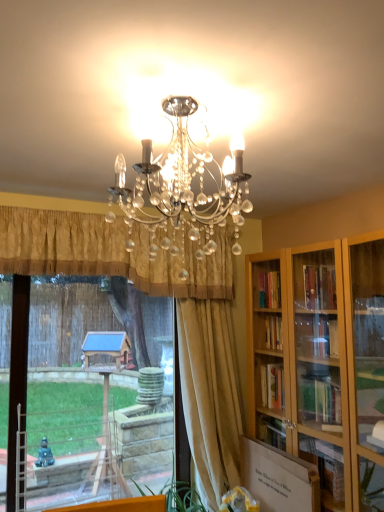
Question: Does gold pleated curtain at center, placed as the first curtain when sorted from left to right, have a smaller size compared to silky beige curtain at center, positioned as the first curtain in right-to-left order?

Choices:
 (A) no
 (B) yes

Answer: (A)

Question: Is gold pleated curtain at center, acting as the 2th curtain starting from the right, beside silky beige curtain at center, positioned as the first curtain in right-to-left order?

Choices:
 (A) yes
 (B) no

Answer: (B)

Question: Considering the relative sizes of gold pleated curtain at center, placed as the first curtain when sorted from left to right, and silky beige curtain at center, positioned as the first curtain in right-to-left order, in the image provided, is gold pleated curtain at center, placed as the first curtain when sorted from left to right, taller than silky beige curtain at center, positioned as the first curtain in right-to-left order,?

Choices:
 (A) no
 (B) yes

Answer: (A)

Question: Is there a large distance between gold pleated curtain at center, placed as the first curtain when sorted from left to right, and silky beige curtain at center, positioned as the second curtain in left-to-right order?

Choices:
 (A) yes
 (B) no

Answer: (B)

Question: Is gold pleated curtain at center, placed as the first curtain when sorted from left to right, completely or partially outside of silky beige curtain at center, positioned as the second curtain in left-to-right order?

Choices:
 (A) no
 (B) yes

Answer: (B)

Question: Is gold pleated curtain at center, acting as the 2th curtain starting from the right, thinner than silky beige curtain at center, positioned as the second curtain in left-to-right order?

Choices:
 (A) no
 (B) yes

Answer: (A)

Question: Considering the relative positions of transparent glass window at center and gold pleated curtain at center, acting as the 2th curtain starting from the right, in the image provided, is transparent glass window at center in front of gold pleated curtain at center, acting as the 2th curtain starting from the right,?

Choices:
 (A) no
 (B) yes

Answer: (A)

Question: From a real-world perspective, is transparent glass window at center positioned over gold pleated curtain at center, acting as the 2th curtain starting from the right, based on gravity?

Choices:
 (A) no
 (B) yes

Answer: (A)

Question: From the image's perspective, is transparent glass window at center located above gold pleated curtain at center, placed as the first curtain when sorted from left to right?

Choices:
 (A) no
 (B) yes

Answer: (A)

Question: Considering the relative sizes of transparent glass window at center and gold pleated curtain at center, placed as the first curtain when sorted from left to right, in the image provided, is transparent glass window at center thinner than gold pleated curtain at center, placed as the first curtain when sorted from left to right,?

Choices:
 (A) yes
 (B) no

Answer: (A)

Question: Can you confirm if transparent glass window at center is taller than gold pleated curtain at center, acting as the 2th curtain starting from the right?

Choices:
 (A) yes
 (B) no

Answer: (A)

Question: From the image's perspective, is transparent glass window at center located beneath gold pleated curtain at center, placed as the first curtain when sorted from left to right?

Choices:
 (A) yes
 (B) no

Answer: (A)

Question: Does silky beige curtain at center, positioned as the second curtain in left-to-right order, have a lesser height compared to gold pleated curtain at center, placed as the first curtain when sorted from left to right?

Choices:
 (A) yes
 (B) no

Answer: (B)